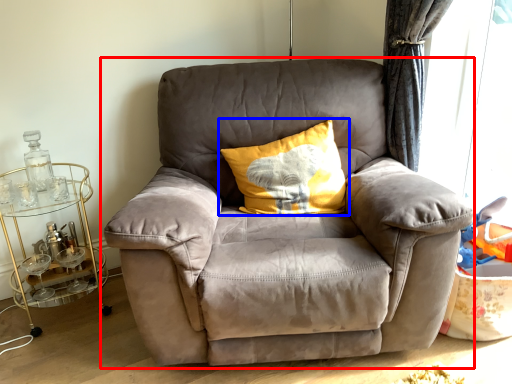
Question: Among these objects, which one is nearest to the camera, chair (highlighted by a red box) or pillow (highlighted by a blue box)?

Choices:
 (A) chair
 (B) pillow

Answer: (A)